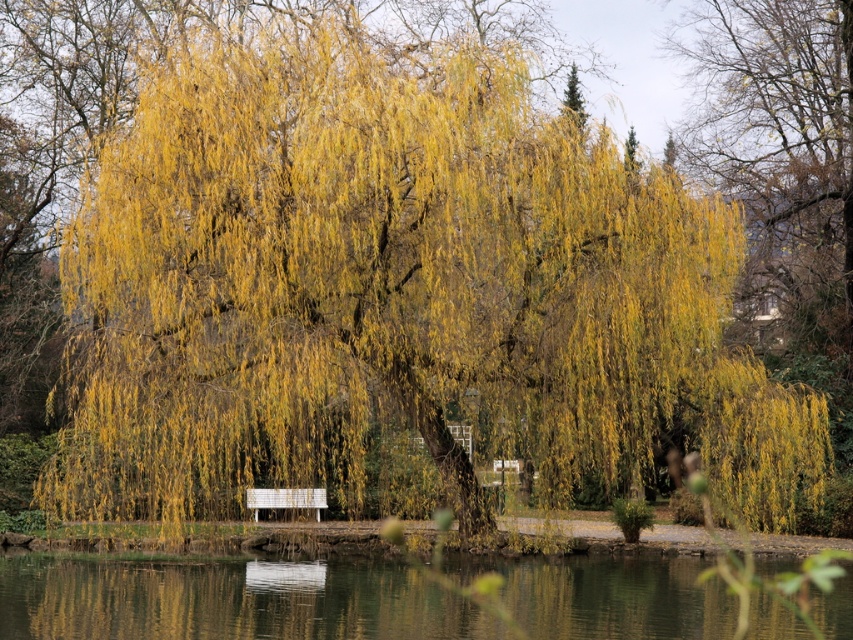
You are standing at the point with coordinates point (x=624, y=618) and want to walk towards the point (x=270, y=493). According to the scene description, which direction should you move to reach your destination?

To reach point (x=270, y=493) from point (x=624, y=618), you should move towards the upper left direction since point (x=270, y=493) is behind point (x=624, y=618).